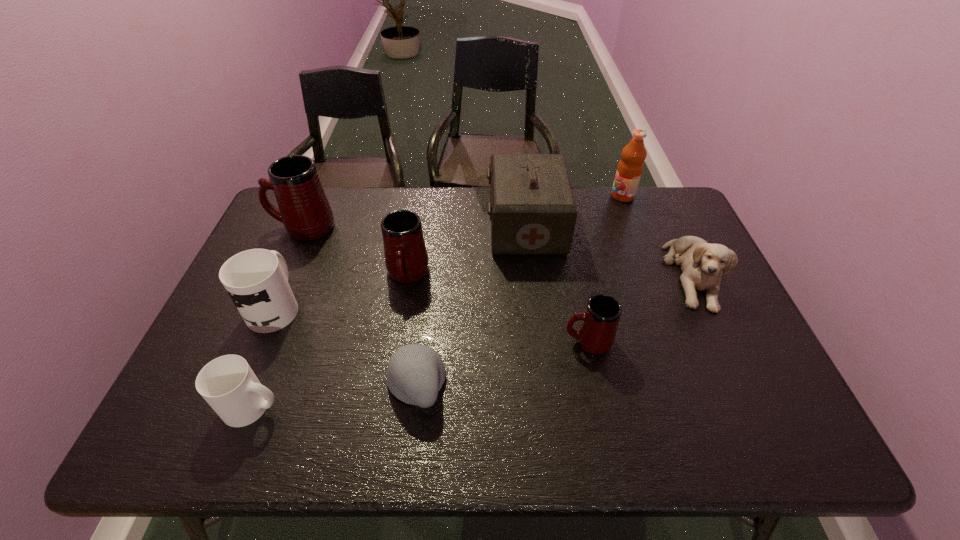
Where is `free location at the near edge`? The width and height of the screenshot is (960, 540). free location at the near edge is located at coordinates (570, 426).

In the image, there is a desktop. Find the location of `vacant space at the left edge`. vacant space at the left edge is located at coordinates (206, 405).

Where is `vacant region at the far left corner of the desktop`? The height and width of the screenshot is (540, 960). vacant region at the far left corner of the desktop is located at coordinates [331, 189].

The width and height of the screenshot is (960, 540). In the image, there is a desktop. In order to click on vacant space at the near left corner in this screenshot , I will do `click(172, 431)`.

Where is `vacant space that's between the tallest mug and the shortest object`? Image resolution: width=960 pixels, height=540 pixels. vacant space that's between the tallest mug and the shortest object is located at coordinates (360, 305).

This screenshot has width=960, height=540. I want to click on free space between the rightmost red mug and the white puppy, so click(640, 308).

Locate an element on the screen. The image size is (960, 540). vacant region between the gray beanie and the red first-aid kit is located at coordinates (471, 305).

At what (x,y) coordinates should I click in order to perform the action: click on free space between the farthest red mug and the second farthest red mug. Please return your answer as a coordinate pair (x, y). The height and width of the screenshot is (540, 960). Looking at the image, I should click on (355, 251).

At what (x,y) coordinates should I click in order to perform the action: click on free spot between the puppy and the second farthest red mug. Please return your answer as a coordinate pair (x, y). Looking at the image, I should click on (550, 275).

You are a GUI agent. You are given a task and a screenshot of the screen. Output one action in this format:
    pyautogui.click(x=<x>, y=<y>)
    Task: Click on the vacant space that is in between the shortest object and the puppy
    
    Given the screenshot: What is the action you would take?
    pyautogui.click(x=554, y=329)